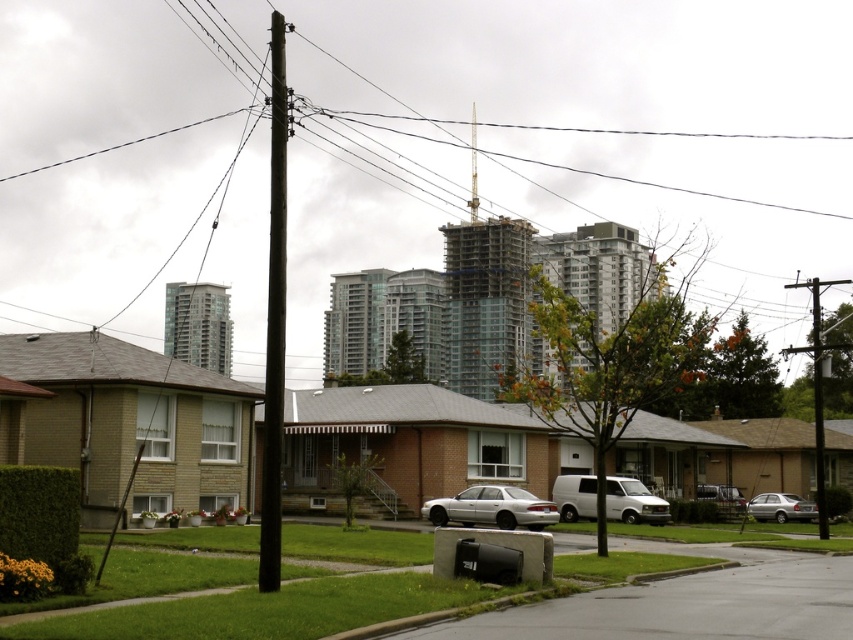
Which is behind, point (283, 104) or point (820, 376)?

Point (820, 376)

Between point (270, 280) and point (824, 285), which one is positioned in front?

Point (270, 280) is more forward.

You are a GUI agent. You are given a task and a screenshot of the screen. Output one action in this format:
    pyautogui.click(x=<x>, y=<y>)
    Task: Click on the brown wooden telegraph pole at center-left
    The height and width of the screenshot is (640, 853).
    Given the screenshot: What is the action you would take?
    pyautogui.click(x=274, y=321)

Between point (554, 518) and point (625, 504), which one is positioned behind?

Point (625, 504)

Based on the photo, can you confirm if silver metallic sedan at center is taller than white matte van at center?

In fact, silver metallic sedan at center may be shorter than white matte van at center.

Where is `silver metallic sedan at center`? This screenshot has width=853, height=640. silver metallic sedan at center is located at coordinates click(x=491, y=508).

Locate an element on the screen. The height and width of the screenshot is (640, 853). silver metallic sedan at center is located at coordinates click(x=491, y=508).

Who is shorter, white matte van at center or silver metallic sedan at lower right?

silver metallic sedan at lower right is shorter.

Consider the image. Is white matte van at center thinner than silver metallic sedan at lower right?

In fact, white matte van at center might be wider than silver metallic sedan at lower right.

Does point (630, 497) lie behind point (798, 512)?

No, it is in front of (798, 512).

In order to click on white matte van at center in this screenshot , I will do click(x=633, y=502).